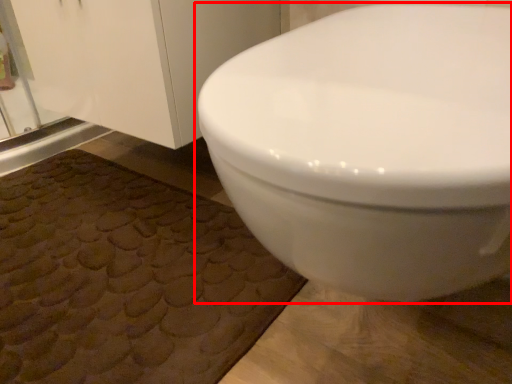
Question: From the image's perspective, where is toilet (annotated by the red box) located relative to bath mat?

Choices:
 (A) below
 (B) above

Answer: (B)